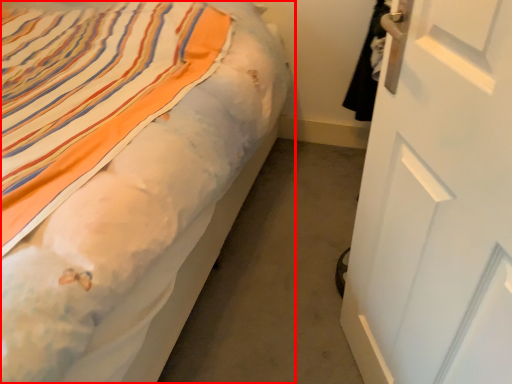
Question: From the image's perspective, where is bed (annotated by the red box) located relative to door?

Choices:
 (A) above
 (B) below

Answer: (A)